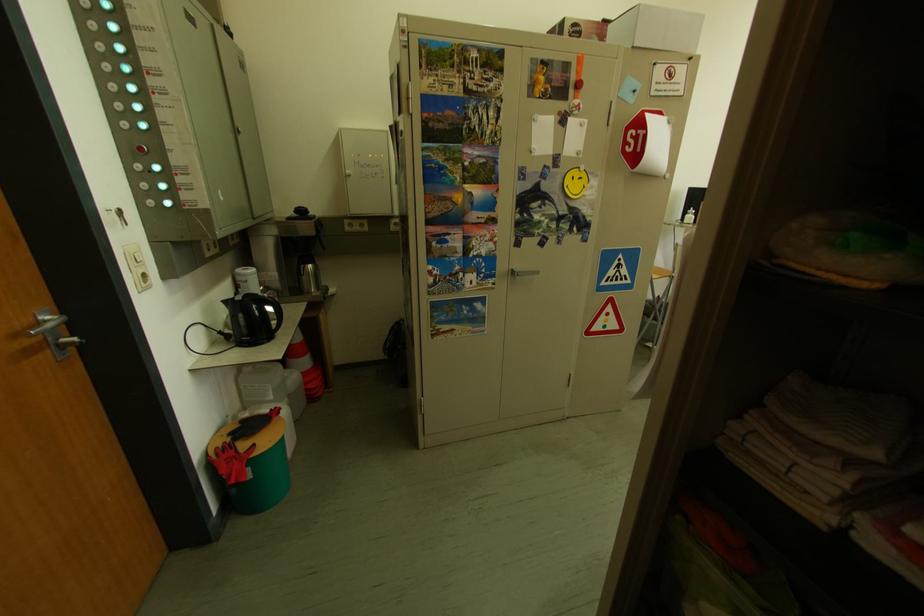
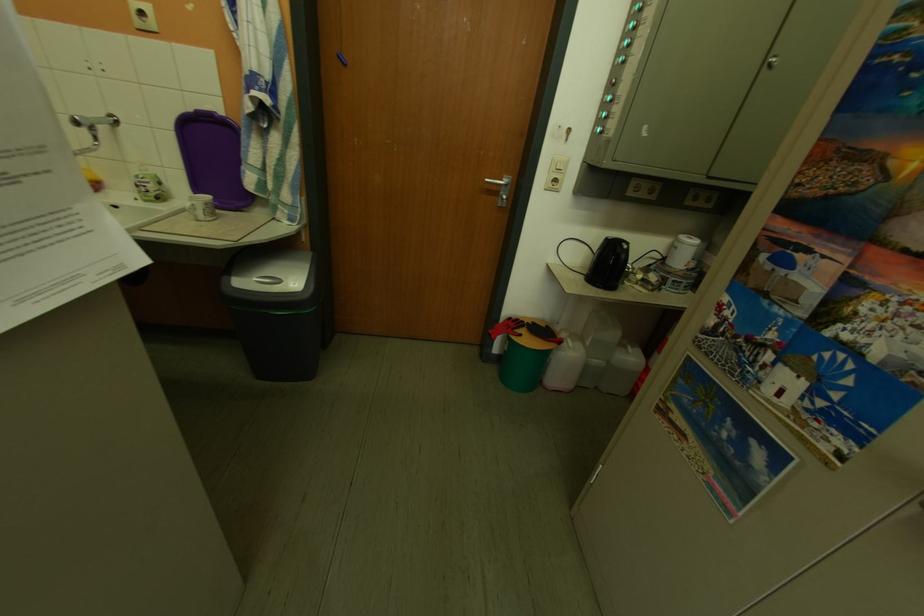
Find the pixel in the second image that matches the point at 247,347 in the first image.

(599, 277)